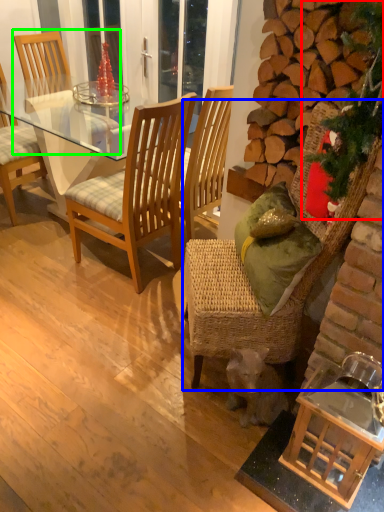
Question: Which object is the closest to the christmas decoration (highlighted by a red box)? Choose among these: chair (highlighted by a blue box) or chair (highlighted by a green box).

Choices:
 (A) chair
 (B) chair

Answer: (A)